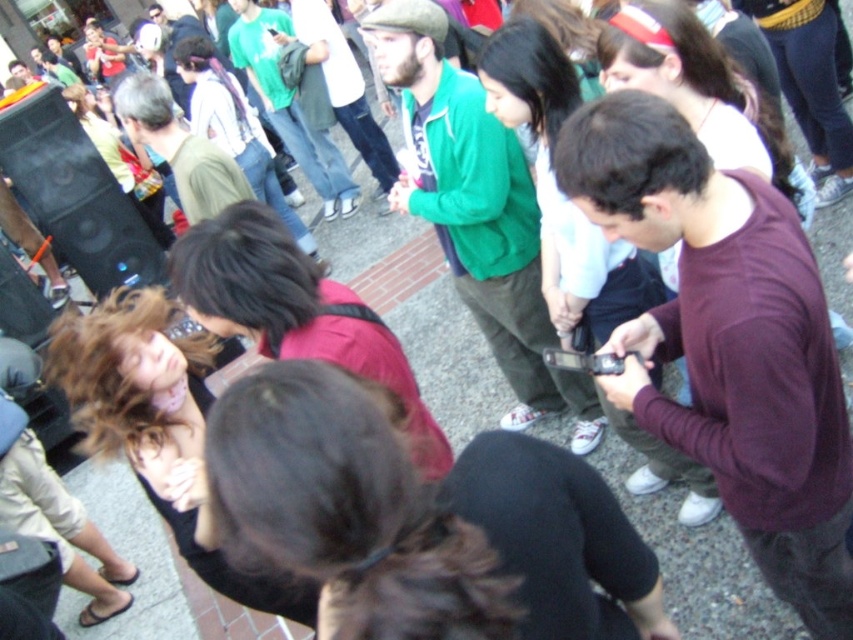
You are standing at the center of the plaza and want to take a photo of both the point at coordinates (474,269) and the point at (589,371). Which point will appear closer to the camera in your photo?

Point (474,269) is further to the camera than point (589,371), so the point at (589,371) will appear closer to the camera in the photo.

In the scene shown: You are a photographer at the event and want to capture both the maroon sweater at center and the black matte speaker at left in a single shot. Which object should you focus on first to ensure both are in frame?

The maroon sweater at center is shorter than the black matte speaker at left, so you should focus on the black matte speaker at left first to ensure both are in frame.

Based on the photo, you are at an event and need to take a photo of the green matte jacket at center. The black matte smartphone at center is nearby. Is the distance between them sufficient for you to capture the jacket in the photo without moving the smartphone?

The green matte jacket at center and the black matte smartphone at center are 5.08 feet apart. Since the smartphone can focus on objects at that distance, you can take the photo without moving the smartphone.